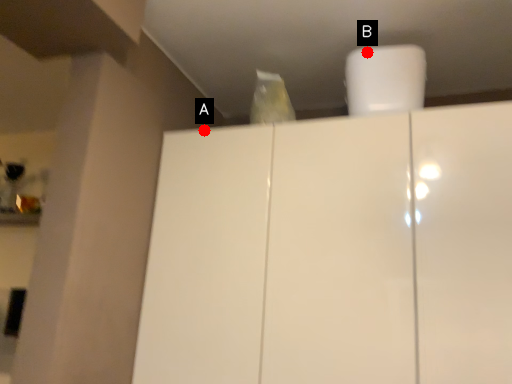
Question: Two points are circled on the image, labeled by A and B beside each circle. Among these points, which one is farthest from the camera?

Choices:
 (A) A is further
 (B) B is further

Answer: (A)